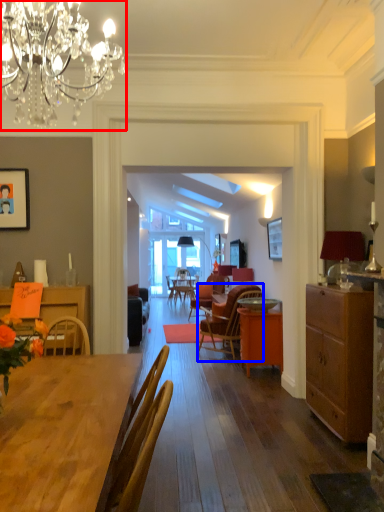
Question: Which point is further to the camera, lamp (highlighted by a red box) or chair (highlighted by a blue box)?

Choices:
 (A) lamp
 (B) chair

Answer: (B)